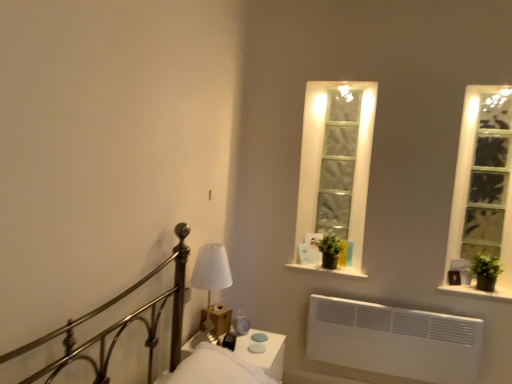
Question: Does clear glass window at right turn towards white fabric lampshade at center?

Choices:
 (A) yes
 (B) no

Answer: (B)

Question: From a real-world perspective, is clear glass window at right beneath white fabric lampshade at center?

Choices:
 (A) no
 (B) yes

Answer: (A)

Question: Does clear glass window at right come in front of white fabric lampshade at center?

Choices:
 (A) no
 (B) yes

Answer: (A)

Question: Considering the relative sizes of clear glass window at right and white fabric lampshade at center in the image provided, is clear glass window at right taller than white fabric lampshade at center?

Choices:
 (A) yes
 (B) no

Answer: (A)

Question: From a real-world perspective, is clear glass window at right located higher than white fabric lampshade at center?

Choices:
 (A) no
 (B) yes

Answer: (B)

Question: Does clear glass window at right lie behind white fabric lampshade at center?

Choices:
 (A) yes
 (B) no

Answer: (A)

Question: Is green matte plant at center, the 2th plant viewed from the right, positioned before black matte window sill at center, the 2th window sill from the bottom?

Choices:
 (A) no
 (B) yes

Answer: (A)

Question: Is green matte plant at center, which is counted as the 1th plant, starting from the left, positioned behind black matte window sill at center, the 2th window sill from the bottom?

Choices:
 (A) yes
 (B) no

Answer: (A)

Question: Is the surface of green matte plant at center, arranged as the second plant when viewed from the front, in direct contact with black matte window sill at center, the 2th window sill from the bottom?

Choices:
 (A) no
 (B) yes

Answer: (A)

Question: Can you confirm if green matte plant at center, the 2th plant viewed from the right, is wider than black matte window sill at center, the 1th window sill in the left-to-right sequence?

Choices:
 (A) no
 (B) yes

Answer: (A)

Question: Can you confirm if green matte plant at center, the first plant positioned from the back, is taller than black matte window sill at center, the 2th window sill from the bottom?

Choices:
 (A) yes
 (B) no

Answer: (A)

Question: Considering the relative sizes of green matte plant at center, the first plant positioned from the back, and black matte window sill at center, the 2th window sill from the bottom, in the image provided, is green matte plant at center, the first plant positioned from the back, shorter than black matte window sill at center, the 2th window sill from the bottom,?

Choices:
 (A) yes
 (B) no

Answer: (B)

Question: Does green matte plant at right, which ranks as the 2th plant in left-to-right order, have a larger size compared to clear glass window at right?

Choices:
 (A) no
 (B) yes

Answer: (A)